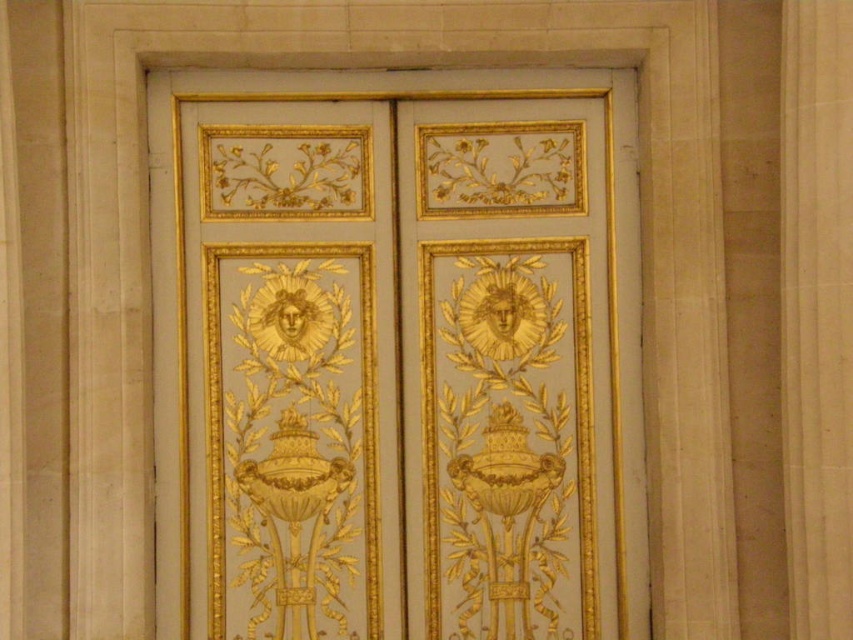
You are standing in front of a grand door and a pillar. The gold painted wood door at center and the white marble pillar at center are both in your view. Which object is positioned to the left from your perspective?

The gold painted wood door at center is to the left of the white marble pillar at center.

From the picture: You are an interior designer planning to place a 1.5 meter wide decorative screen between the gold painted wood door at center and the white marble pillar at center. Based on the available space, will the screen fit without overlapping either object?

The gold painted wood door at center is 1.81 meters from the white marble pillar at center. Since the screen is 1.5 meters wide, there is enough space between them to place the screen without overlapping either object.

Based on the photo, you are an interior designer inspecting the ornate door. You notice a specific point marked at coordinates (396, 355). Based on the door design described, where is this point located?

The point at (396, 355) is on the gold painted wood door at center, specifically within the lower section of the central motif area where the symmetrical designs are centered.